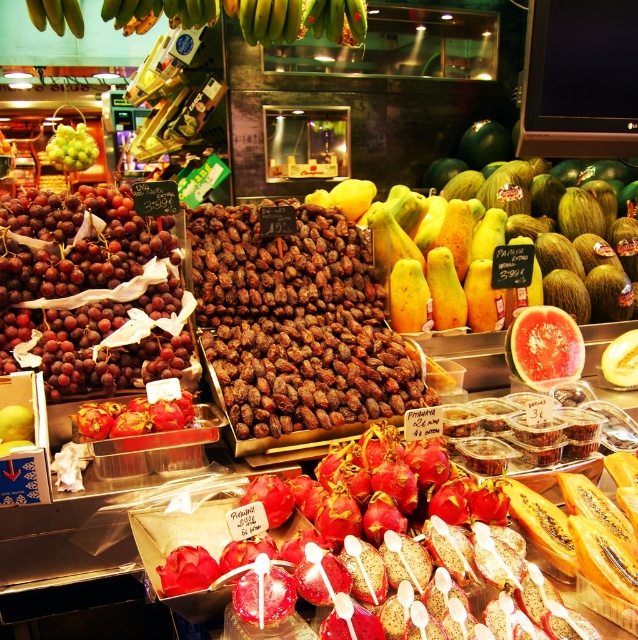
Question: Does shiny purple grapes at left appear on the left side of green matte bananas at upper center?

Choices:
 (A) no
 (B) yes

Answer: (B)

Question: Which point appears closest to the camera in this image?

Choices:
 (A) (68, 152)
 (B) (501, 308)
 (C) (234, 237)

Answer: (C)

Question: Does watermelon flesh at center appear under green matte bananas at upper center?

Choices:
 (A) no
 (B) yes

Answer: (B)

Question: Is watermelon flesh at center below green matte bananas at upper left?

Choices:
 (A) yes
 (B) no

Answer: (A)

Question: Estimate the real-world distances between objects in this image. Which object is closer to the green matte grapes at upper left?

Choices:
 (A) brown rough dates at center
 (B) green matte bananas at upper center

Answer: (B)

Question: Estimate the real-world distances between objects in this image. Which object is farther from the shiny purple grapes at left?

Choices:
 (A) watermelon flesh at center
 (B) green matte bananas at upper left
 (C) brown rough dates at center
 (D) yellow matte papaya at center

Answer: (A)